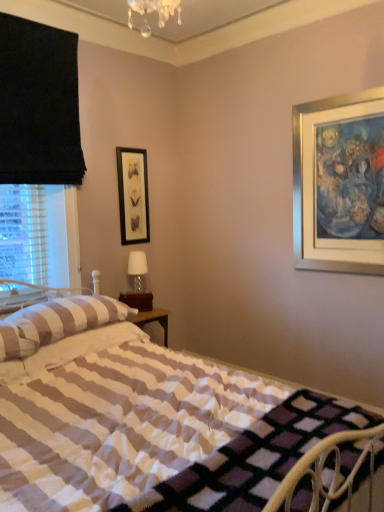
Where is `white matte table lamp at center`? The height and width of the screenshot is (512, 384). white matte table lamp at center is located at coordinates (137, 283).

The width and height of the screenshot is (384, 512). Describe the element at coordinates (62, 319) in the screenshot. I see `striped fabric pillow at left` at that location.

What do you see at coordinates (133, 195) in the screenshot?
I see `black matte picture frame at upper center` at bounding box center [133, 195].

The height and width of the screenshot is (512, 384). Find the location of `black matte picture frame at upper center`. black matte picture frame at upper center is located at coordinates (133, 195).

Where is `white matte table lamp at center`? This screenshot has width=384, height=512. white matte table lamp at center is located at coordinates (137, 283).

From the image's perspective, would you say white striped fabric bed at center is positioned over black matte picture frame at upper center?

Incorrect, from the image's perspective, white striped fabric bed at center is lower than black matte picture frame at upper center.

Between point (73, 424) and point (134, 173), which one is positioned behind?

The point (134, 173) is more distant.

Is white striped fabric bed at center to the left or to the right of black matte picture frame at upper center in the image?

white striped fabric bed at center is positioned on black matte picture frame at upper center's right side.

The image size is (384, 512). What are the coordinates of `bed on the right of black matte picture frame at upper center` in the screenshot? It's located at (136, 420).

How many degrees apart are the facing directions of white striped fabric bed at center and striped fabric pillow at left?

0.000245 degrees separate the facing orientations of white striped fabric bed at center and striped fabric pillow at left.

From the picture: Who is smaller, white striped fabric bed at center or striped fabric pillow at left?

Smaller between the two is striped fabric pillow at left.

Is white striped fabric bed at center wider or thinner than striped fabric pillow at left?

In the image, white striped fabric bed at center appears to be wider than striped fabric pillow at left.

Considering the positions of point (44, 440) and point (117, 320), is point (44, 440) closer or farther from the camera than point (117, 320)?

Clearly, point (44, 440) is closer to the camera than point (117, 320).

From the image's perspective, is black matte picture frame at upper center positioned above or below striped fabric pillow at left?

black matte picture frame at upper center is situated higher than striped fabric pillow at left in the image.

Is black matte picture frame at upper center touching striped fabric pillow at left?

No, black matte picture frame at upper center is not with striped fabric pillow at left.

Is black matte picture frame at upper center looking in the opposite direction of striped fabric pillow at left?

No, striped fabric pillow at left is not at the back of black matte picture frame at upper center.

How many degrees apart are the facing directions of black matte picture frame at upper center and striped fabric pillow at left?

black matte picture frame at upper center and striped fabric pillow at left are facing 1.59 degrees away from each other.

Is black matte picture frame at upper center a part of striped fabric pillow at left?

No.

Considering the relative positions of striped fabric pillow at left and black matte picture frame at upper center in the image provided, is striped fabric pillow at left behind black matte picture frame at upper center?

No.

Between striped fabric pillow at left and black matte picture frame at upper center, which one has larger size?

Bigger between the two is striped fabric pillow at left.

From a real-world perspective, who is located lower, striped fabric pillow at left or black matte picture frame at upper center?

striped fabric pillow at left.

Is white matte table lamp at center far from white striped fabric bed at center?

white matte table lamp at center is positioned a significant distance from white striped fabric bed at center.

Which is less distant, [135,295] or [20,388]?

The point [20,388] is more forward.

Who is smaller, white matte table lamp at center or white striped fabric bed at center?

white matte table lamp at center.

Measure the distance between white matte table lamp at center and white striped fabric bed at center.

A distance of 3.78 feet exists between white matte table lamp at center and white striped fabric bed at center.

In the scene shown: Is black matte picture frame at upper center surrounded by white matte table lamp at center?

No, black matte picture frame at upper center is not inside white matte table lamp at center.

From a real-world perspective, is white matte table lamp at center positioned above or below black matte picture frame at upper center?

white matte table lamp at center is below black matte picture frame at upper center.

The image size is (384, 512). In order to click on table lamp located in front of the black matte picture frame at upper center in this screenshot , I will do `click(137, 283)`.

Is white matte table lamp at center located outside striped fabric pillow at left?

Yes, white matte table lamp at center is located beyond the bounds of striped fabric pillow at left.

Considering the points (133, 288) and (35, 341), which point is in front, point (133, 288) or point (35, 341)?

Positioned in front is point (35, 341).

Looking at the image, does white matte table lamp at center seem bigger or smaller compared to striped fabric pillow at left?

In the image, white matte table lamp at center appears to be smaller than striped fabric pillow at left.

From a real-world perspective, between white matte table lamp at center and striped fabric pillow at left, who is vertically lower?

In real-world perspective, striped fabric pillow at left is lower.

This screenshot has width=384, height=512. Identify the location of bed below the black matte picture frame at upper center (from a real-world perspective). (136, 420).

The image size is (384, 512). I want to click on bed in front of the striped fabric pillow at left, so click(136, 420).

Which object lies nearer to the anchor point white striped fabric bed at center, black matte picture frame at upper center or striped fabric pillow at left?

The object closer to white striped fabric bed at center is striped fabric pillow at left.

Looking at the image, which one is located closer to black matte picture frame at upper center, white striped fabric bed at center or striped fabric pillow at left?

Among the two, striped fabric pillow at left is located nearer to black matte picture frame at upper center.

Based on their spatial positions, is striped fabric pillow at left or white striped fabric bed at center further from black matte picture frame at upper center?

Based on the image, white striped fabric bed at center appears to be further to black matte picture frame at upper center.

When comparing their distances from white matte table lamp at center, does white striped fabric bed at center or striped fabric pillow at left seem further?

white striped fabric bed at center is positioned further to the anchor white matte table lamp at center.

Based on the photo, from the image, which object appears to be nearer to white striped fabric bed at center, white matte table lamp at center or black matte picture frame at upper center?

Based on the image, white matte table lamp at center appears to be nearer to white striped fabric bed at center.

Estimate the real-world distances between objects in this image. Which object is closer to white matte table lamp at center, black matte picture frame at upper center or white striped fabric bed at center?

black matte picture frame at upper center lies closer to white matte table lamp at center than the other object.

Looking at the image, which one is located closer to white matte table lamp at center, black matte picture frame at upper center or striped fabric pillow at left?

black matte picture frame at upper center lies closer to white matte table lamp at center than the other object.

Looking at the image, which one is located further to striped fabric pillow at left, black matte picture frame at upper center or white matte table lamp at center?

black matte picture frame at upper center.

Where is `pillow between white striped fabric bed at center and black matte picture frame at upper center along the z-axis`? pillow between white striped fabric bed at center and black matte picture frame at upper center along the z-axis is located at coordinates (62, 319).

Identify the location of pillow positioned between white striped fabric bed at center and white matte table lamp at center from near to far. The image size is (384, 512). (62, 319).

In order to click on table lamp located between striped fabric pillow at left and black matte picture frame at upper center in the depth direction in this screenshot , I will do `click(137, 283)`.

You are a GUI agent. You are given a task and a screenshot of the screen. Output one action in this format:
    pyautogui.click(x=<x>, y=<y>)
    Task: Click on the table lamp positioned between white striped fabric bed at center and black matte picture frame at upper center from near to far
    
    Given the screenshot: What is the action you would take?
    pyautogui.click(x=137, y=283)